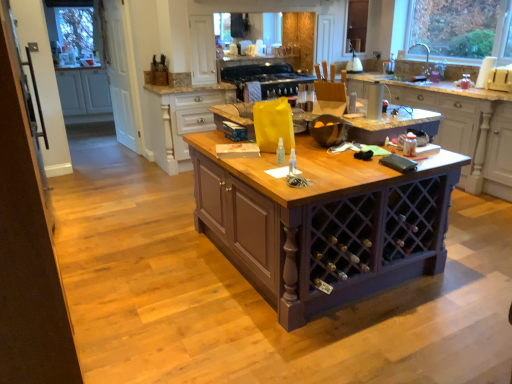
Question: In terms of height, does white matte cabinet at left, the first cabinetry from the back, look taller or shorter compared to white wood cabinet at upper center, which appears as the second cabinetry when viewed from the left?

Choices:
 (A) short
 (B) tall

Answer: (A)

Question: From a real-world perspective, relative to white wood cabinet at upper center, which is the 2th cabinetry in right-to-left order, is white matte cabinet at left, marked as the third cabinetry in a front-to-back arrangement, vertically above or below?

Choices:
 (A) below
 (B) above

Answer: (B)

Question: Estimate the real-world distances between objects in this image. Which object is closer to the white glossy kettle at upper center, acting as the second appliance starting from the left?

Choices:
 (A) purple wood table at center
 (B) black matte stove at upper center
 (C) clear glass door at left
 (D) black matte bowl at center, the 2th appliance from the back
 (E) white wood cabinet at upper center, which is the 2th cabinetry from back to front

Answer: (B)

Question: Which object is positioned closest to the black matte stove at upper center?

Choices:
 (A) purple wood cabinet at center, which ranks as the third cabinetry in left-to-right order
 (B) clear glass window at upper right
 (C) white wood cabinet at upper center, which appears as the second cabinetry when viewed from the left
 (D) white matte cabinet at left, which is the third cabinetry from right to left
 (E) white glossy kettle at upper center, acting as the second appliance starting from the left

Answer: (C)